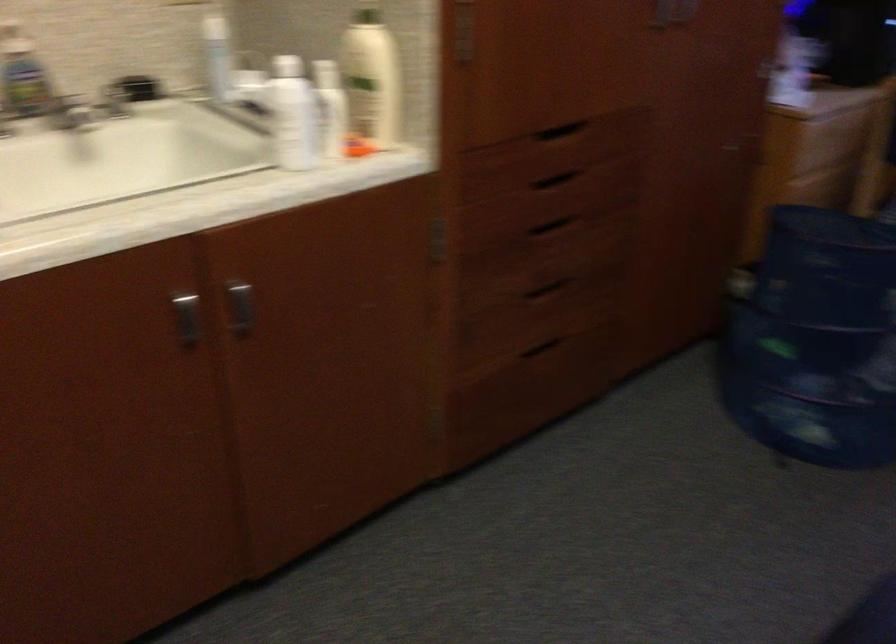
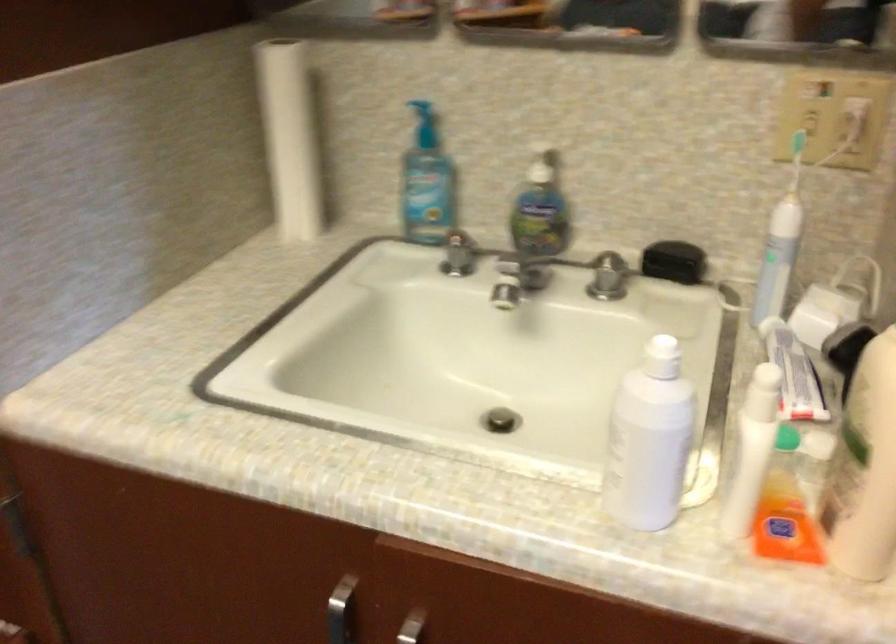
Question: The camera is either moving clockwise (left) or counter-clockwise (right) around the object. The first image is from the beginning of the video and the second image is from the end. Is the camera moving left or right when shooting the video?

Choices:
 (A) Left
 (B) Right

Answer: (B)